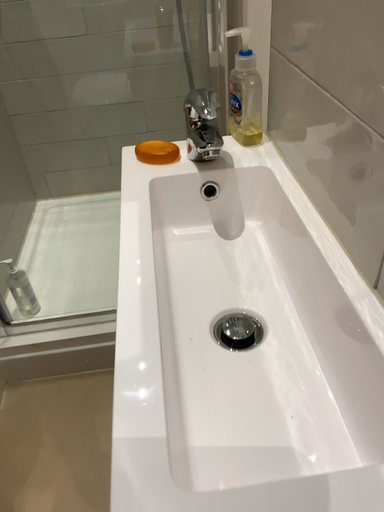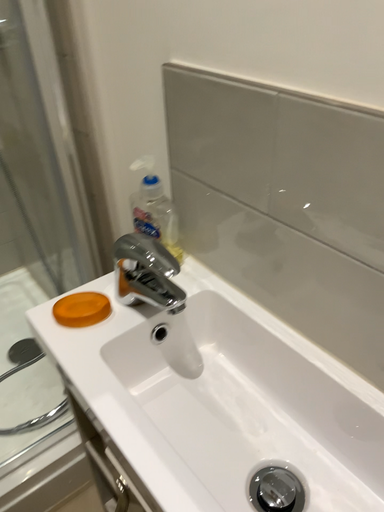
Question: Which way did the camera rotate in the video?

Choices:
 (A) rotated right
 (B) rotated left

Answer: (A)